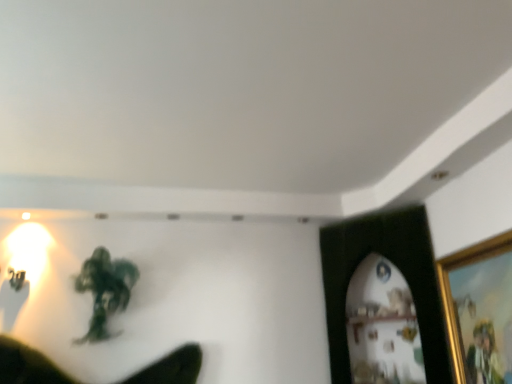
Question: From the image's perspective, is gold-framed picture at right, marked as the second picture frame in a back-to-front arrangement, on black matte picture frame at upper right, which appears as the 2th picture frame when viewed from the front?

Choices:
 (A) no
 (B) yes

Answer: (B)

Question: Does gold-framed picture at right, which is the first picture frame from front to back, have a lesser height compared to black matte picture frame at upper right, which appears as the 2th picture frame when viewed from the front?

Choices:
 (A) no
 (B) yes

Answer: (B)

Question: Is gold-framed picture at right, which is the first picture frame from front to back, positioned far away from black matte picture frame at upper right, which appears as the 2th picture frame when viewed from the front?

Choices:
 (A) yes
 (B) no

Answer: (B)

Question: Is gold-framed picture at right, marked as the second picture frame in a back-to-front arrangement, looking in the opposite direction of black matte picture frame at upper right, the first picture frame positioned from the back?

Choices:
 (A) no
 (B) yes

Answer: (A)

Question: From a real-world perspective, is gold-framed picture at right, marked as the second picture frame in a back-to-front arrangement, beneath black matte picture frame at upper right, which appears as the 2th picture frame when viewed from the front?

Choices:
 (A) yes
 (B) no

Answer: (A)

Question: In the image, is green matte figure at center positioned in front of or behind gold-framed picture at right, marked as the second picture frame in a back-to-front arrangement?

Choices:
 (A) front
 (B) behind

Answer: (B)

Question: In terms of height, does green matte figure at center look taller or shorter compared to gold-framed picture at right, which is the first picture frame from front to back?

Choices:
 (A) short
 (B) tall

Answer: (A)

Question: Is green matte figure at center bigger or smaller than gold-framed picture at right, marked as the second picture frame in a back-to-front arrangement?

Choices:
 (A) big
 (B) small

Answer: (A)

Question: Looking at their shapes, would you say green matte figure at center is wider or thinner than gold-framed picture at right, which is the first picture frame from front to back?

Choices:
 (A) thin
 (B) wide

Answer: (B)

Question: Based on their positions, is gold-framed picture at right, marked as the second picture frame in a back-to-front arrangement, located to the left or right of green matte figure at center?

Choices:
 (A) right
 (B) left

Answer: (A)

Question: Is gold-framed picture at right, marked as the second picture frame in a back-to-front arrangement, bigger or smaller than green matte figure at center?

Choices:
 (A) small
 (B) big

Answer: (A)

Question: From their relative heights in the image, would you say gold-framed picture at right, which is the first picture frame from front to back, is taller or shorter than green matte figure at center?

Choices:
 (A) short
 (B) tall

Answer: (B)

Question: From the image's perspective, is gold-framed picture at right, marked as the second picture frame in a back-to-front arrangement, above or below green matte figure at center?

Choices:
 (A) below
 (B) above

Answer: (B)

Question: From a real-world perspective, is gold-framed picture at right, marked as the second picture frame in a back-to-front arrangement, above or below black matte picture frame at upper right, which appears as the 2th picture frame when viewed from the front?

Choices:
 (A) above
 (B) below

Answer: (B)

Question: Visually, is gold-framed picture at right, marked as the second picture frame in a back-to-front arrangement, positioned to the left or to the right of black matte picture frame at upper right, which appears as the 2th picture frame when viewed from the front?

Choices:
 (A) left
 (B) right

Answer: (B)